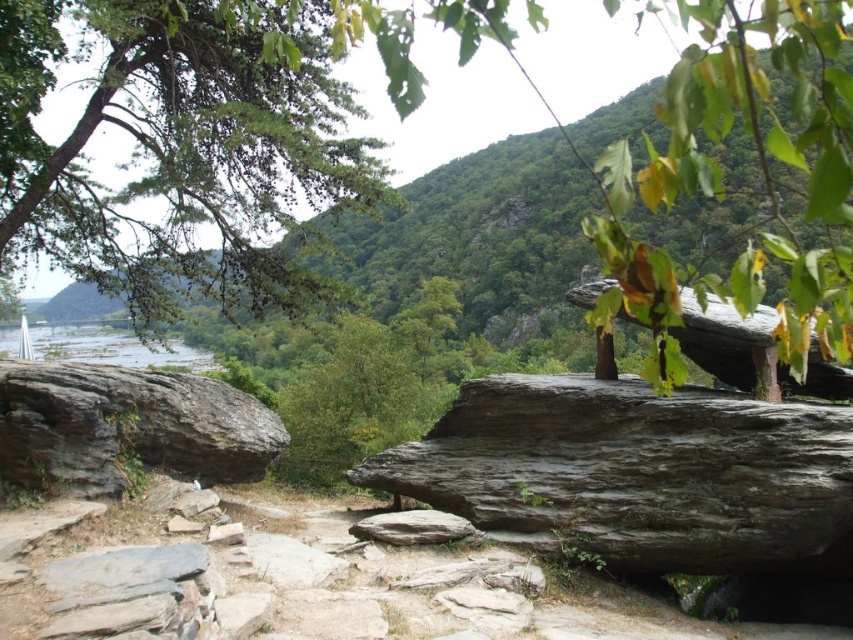
Who is taller, green matte tree at upper left or gray rough boulder at left?

Standing taller between the two is green matte tree at upper left.

Between green matte tree at upper left and gray rough boulder at left, which one has less height?

With less height is gray rough boulder at left.

At what (x,y) coordinates should I click in order to perform the action: click on green matte tree at upper left. Please return your answer as a coordinate pair (x, y). Image resolution: width=853 pixels, height=640 pixels. Looking at the image, I should click on (183, 147).

Is green matte tree at upper left wider than dark gray textured boulder at center?

Correct, the width of green matte tree at upper left exceeds that of dark gray textured boulder at center.

Between green matte tree at upper left and dark gray textured boulder at center, which one has more height?

green matte tree at upper left

Where is `green matte tree at upper left`? The width and height of the screenshot is (853, 640). green matte tree at upper left is located at coordinates (183, 147).

The height and width of the screenshot is (640, 853). I want to click on green matte tree at upper left, so pos(183,147).

Can you confirm if dark gray textured boulder at center is taller than gray rough boulder at left?

Yes, dark gray textured boulder at center is taller than gray rough boulder at left.

Which is behind, point (583, 468) or point (103, 401)?

Positioned behind is point (583, 468).

Which is behind, point (798, 516) or point (169, 412)?

The point (169, 412) is more distant.

At what (x,y) coordinates should I click in order to perform the action: click on dark gray textured boulder at center. Please return your answer as a coordinate pair (x, y). Looking at the image, I should click on point(637,472).